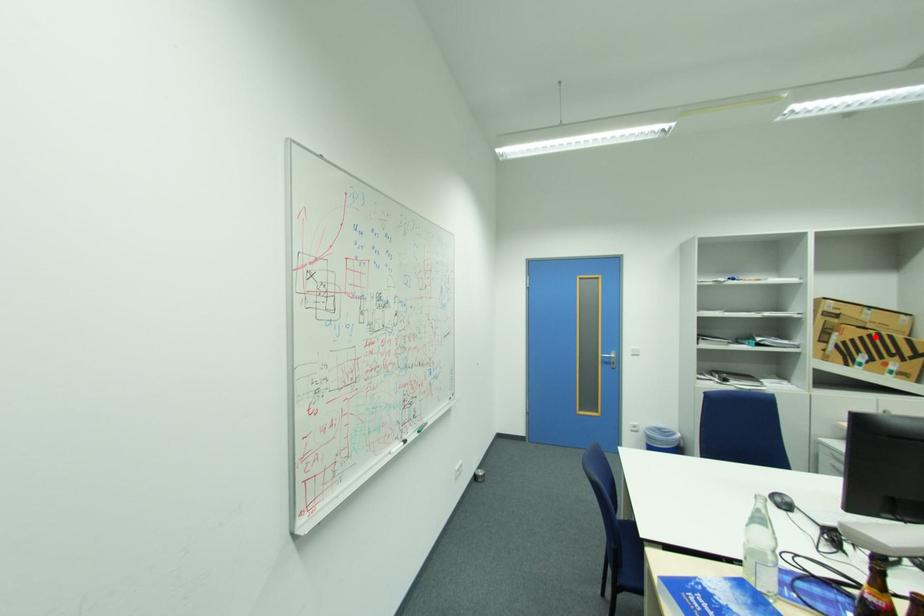
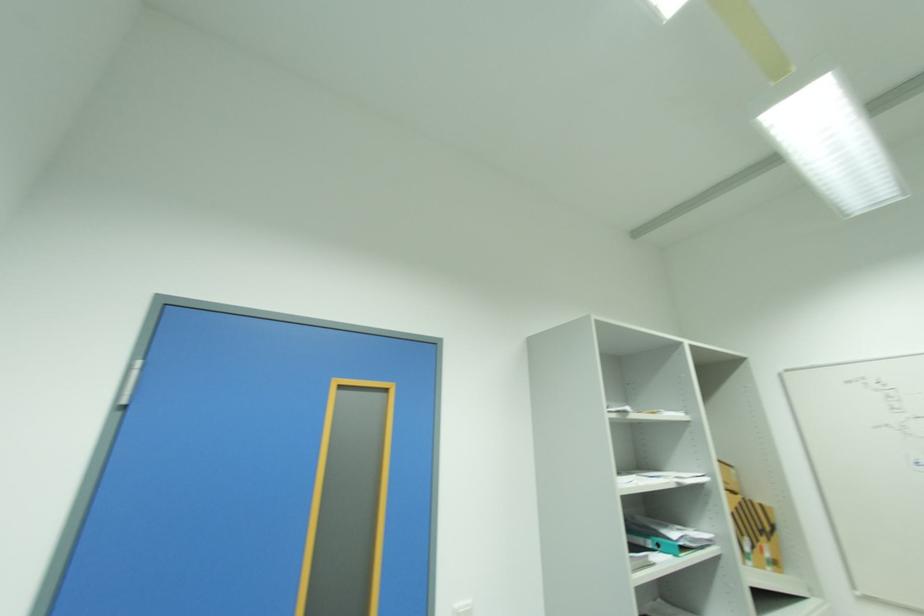
Locate, in the second image, the point that corresponds to the highlighted location in the first image.

(746, 506)